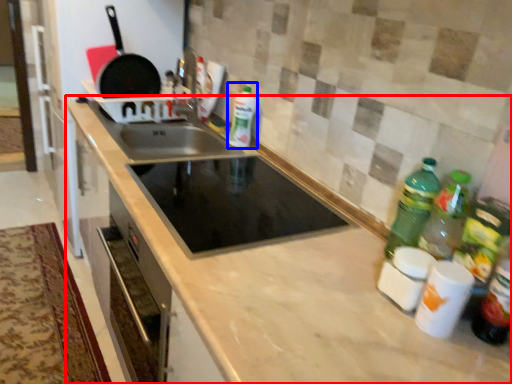
Question: Which object is closer to the camera taking this photo, countertop (highlighted by a red box) or bottle (highlighted by a blue box)?

Choices:
 (A) countertop
 (B) bottle

Answer: (A)